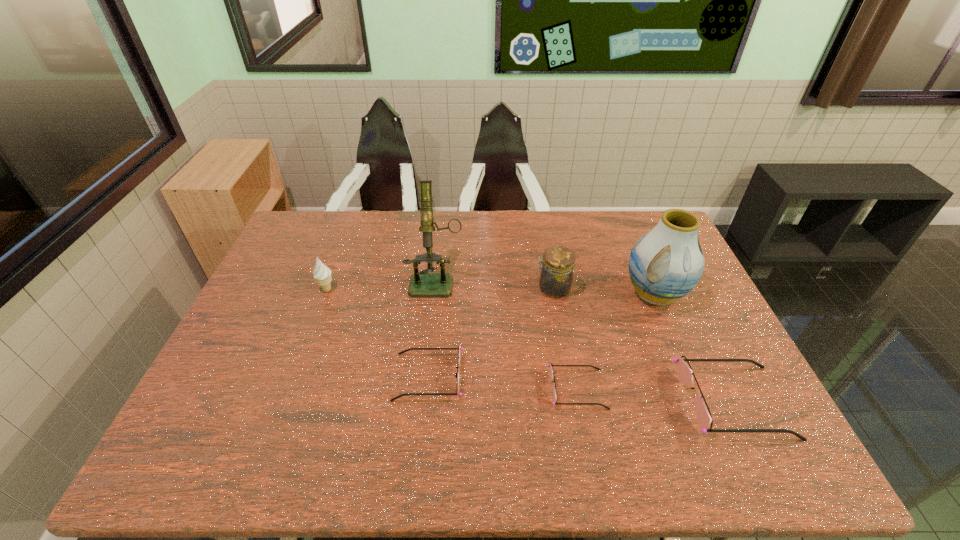
Please point out where to position a new sunglasses on the left to maintain spacing. Please provide its 2D coordinates. Your answer should be formatted as a tuple, i.e. [(x, y)], where the tuple contains the x and y coordinates of a point satisfying the conditions above.

[(288, 365)]